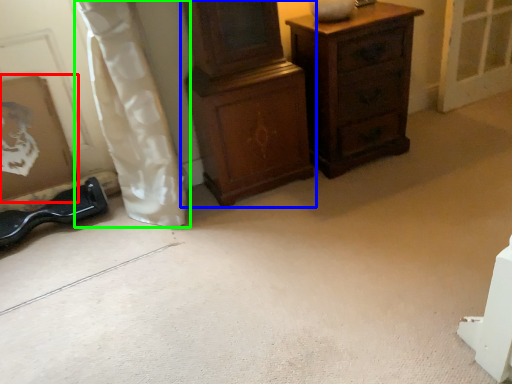
Question: Which object is positioned closest to picture frame (highlighted by a red box)? Select from chest of drawers (highlighted by a blue box) and curtain (highlighted by a green box).

Choices:
 (A) chest of drawers
 (B) curtain

Answer: (B)